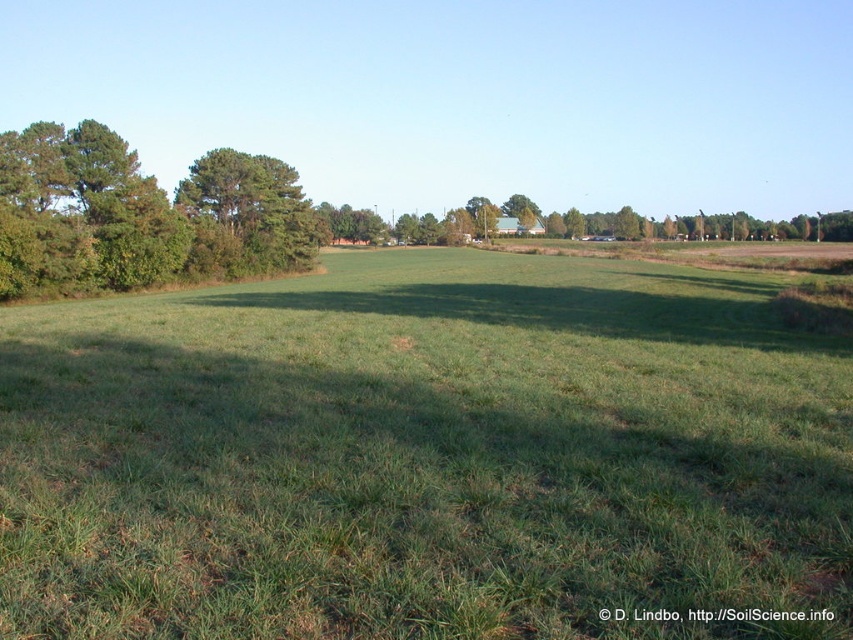
This screenshot has width=853, height=640. What do you see at coordinates (425, 456) in the screenshot?
I see `green grass at center` at bounding box center [425, 456].

Who is more forward, (30, 625) or (126, 230)?

Point (30, 625)

The height and width of the screenshot is (640, 853). Identify the location of green grass at center. (425, 456).